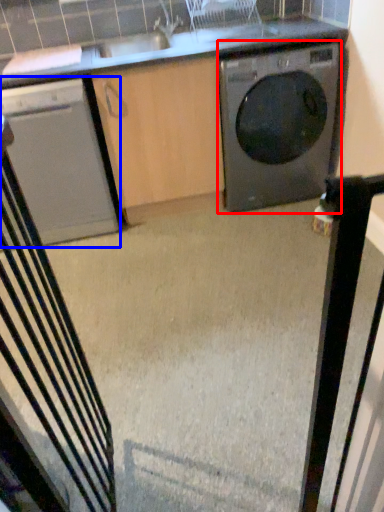
Question: Which object appears farthest to the camera in this image, washing machine (highlighted by a red box) or home appliance (highlighted by a blue box)?

Choices:
 (A) washing machine
 (B) home appliance

Answer: (A)